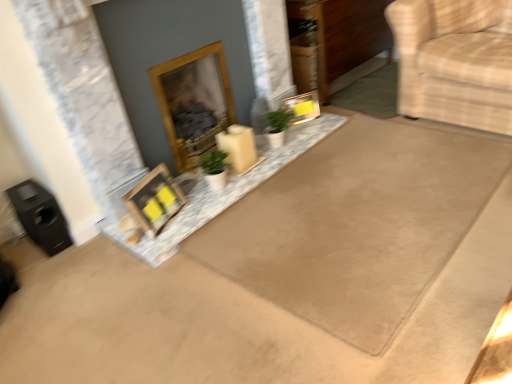
What do you see at coordinates (303, 107) in the screenshot?
I see `matte gold picture frame at center, the 2th picture frame positioned from the front` at bounding box center [303, 107].

Describe the element at coordinates (194, 102) in the screenshot. This screenshot has height=384, width=512. I see `wooden fireplace at center` at that location.

This screenshot has height=384, width=512. What do you see at coordinates (154, 201) in the screenshot?
I see `wooden picture frame at center, acting as the 2th picture frame starting from the right` at bounding box center [154, 201].

Image resolution: width=512 pixels, height=384 pixels. I want to click on beige carpet at upper right, which is the 2th doormat in left-to-right order, so click(x=371, y=93).

In the scene shown: What is the approximate height of beige carpet at center, marked as the first doormat in a left-to-right arrangement?

beige carpet at center, marked as the first doormat in a left-to-right arrangement, is 3.67 centimeters tall.

What are the coordinates of `matte gold picture frame at center, which is the second picture frame from left to right` in the screenshot? It's located at (303, 107).

Which object is thinner, white marble tray at center or matte gold picture frame at center, the 1th picture frame when ordered from right to left?

matte gold picture frame at center, the 1th picture frame when ordered from right to left.

Is the position of white marble tray at center less distant than that of matte gold picture frame at center, which is the second picture frame from left to right?

That is True.

Choose the correct answer: Is white marble tray at center inside matte gold picture frame at center, the 1th picture frame when ordered from right to left, or outside it?

white marble tray at center exists outside the volume of matte gold picture frame at center, the 1th picture frame when ordered from right to left.

From the image's perspective, between white marble tray at center and matte gold picture frame at center, which ranks as the 2th picture frame in bottom-to-top order, who is located below?

white marble tray at center, from the image's perspective.

In the scene shown: Is beige fabric armchair at right shorter than wooden picture frame at center, which appears as the 1th picture frame when viewed from the left?

No, beige fabric armchair at right is not shorter than wooden picture frame at center, which appears as the 1th picture frame when viewed from the left.

From a real-world perspective, is beige fabric armchair at right positioned under wooden picture frame at center, which appears as the second picture frame when viewed from the top, based on gravity?

No, from a real-world perspective, beige fabric armchair at right is not beneath wooden picture frame at center, which appears as the second picture frame when viewed from the top.

Can you tell me how much beige fabric armchair at right and wooden picture frame at center, which appears as the second picture frame when viewed from the top, differ in facing direction?

The facing directions of beige fabric armchair at right and wooden picture frame at center, which appears as the second picture frame when viewed from the top, are 106 degrees apart.

From the image's perspective, which object appears higher, beige fabric armchair at right or wooden picture frame at center, which is the 1th picture frame in bottom-to-top order?

From the image's view, beige fabric armchair at right is above.

Is beige carpet at upper right, positioned as the 1th doormat in right-to-left order, shorter than wooden fireplace at center?

Yes, beige carpet at upper right, positioned as the 1th doormat in right-to-left order, is shorter than wooden fireplace at center.

Is point (388, 94) positioned after point (176, 78)?

Yes.

Which object is positioned more to the right, beige carpet at upper right, which is the 2th doormat in left-to-right order, or wooden fireplace at center?

Positioned to the right is beige carpet at upper right, which is the 2th doormat in left-to-right order.

From a real-world perspective, who is located higher, wooden fireplace at center or matte gold picture frame at center, the 1th picture frame when ordered from back to front?

wooden fireplace at center, from a real-world perspective.

From the image's perspective, which is below, wooden fireplace at center or matte gold picture frame at center, the 1th picture frame when ordered from back to front?

wooden fireplace at center appears lower in the image.

Considering the relative sizes of wooden fireplace at center and matte gold picture frame at center, the 1th picture frame when ordered from right to left, in the image provided, is wooden fireplace at center shorter than matte gold picture frame at center, the 1th picture frame when ordered from right to left,?

Incorrect, the height of wooden fireplace at center does not fall short of that of matte gold picture frame at center, the 1th picture frame when ordered from right to left.

Does point (187, 106) lie in front of point (294, 98)?

Yes, point (187, 106) is in front of point (294, 98).

Can you confirm if wooden picture frame at center, which appears as the 1th picture frame when viewed from the left, is bigger than beige carpet at center, marked as the first doormat in a left-to-right arrangement?

No.

From the image's perspective, relative to beige carpet at center, marked as the first doormat in a left-to-right arrangement, is wooden picture frame at center, which appears as the second picture frame when viewed from the top, above or below?

Based on their image positions, wooden picture frame at center, which appears as the second picture frame when viewed from the top, is located beneath beige carpet at center, marked as the first doormat in a left-to-right arrangement.

Where is `the 2nd picture frame to the left of the beige carpet at center, acting as the second doormat starting from the right, counting from the anchor's position`? This screenshot has height=384, width=512. the 2nd picture frame to the left of the beige carpet at center, acting as the second doormat starting from the right, counting from the anchor's position is located at coordinates (154, 201).

Between wooden picture frame at center, which appears as the 1th picture frame when viewed from the left, and beige carpet at center, marked as the first doormat in a left-to-right arrangement, which one has larger width?

beige carpet at center, marked as the first doormat in a left-to-right arrangement, is wider.

From the image's perspective, which picture frame is the 1st one below the beige carpet at upper right, positioned as the 1th doormat in right-to-left order? Please provide its 2D coordinates.

[(303, 107)]

What's the angular difference between matte gold picture frame at center, which ranks as the 2th picture frame in bottom-to-top order, and beige carpet at upper right, positioned as the 1th doormat in right-to-left order,'s facing directions?

The facing directions of matte gold picture frame at center, which ranks as the 2th picture frame in bottom-to-top order, and beige carpet at upper right, positioned as the 1th doormat in right-to-left order, are 65.4 degrees apart.

Which object is further away from the camera taking this photo, matte gold picture frame at center, the 2th picture frame positioned from the front, or beige carpet at upper right, which is the 2th doormat in left-to-right order?

beige carpet at upper right, which is the 2th doormat in left-to-right order, is behind.

How distant is matte gold picture frame at center, the 2th picture frame positioned from the front, from beige carpet at upper right, which is the 2th doormat in left-to-right order?

matte gold picture frame at center, the 2th picture frame positioned from the front, and beige carpet at upper right, which is the 2th doormat in left-to-right order, are 19.50 inches apart from each other.

Based on the photo, is beige fabric armchair at right shorter than white marble tray at center?

In fact, beige fabric armchair at right may be taller than white marble tray at center.

Which of these two, beige fabric armchair at right or white marble tray at center, is bigger?

Bigger between the two is beige fabric armchair at right.

In the scene shown: How much distance is there between beige fabric armchair at right and white marble tray at center?

They are 33.60 inches apart.

From the image's perspective, is beige fabric armchair at right on white marble tray at center?

Yes, from the image's perspective, beige fabric armchair at right is on top of white marble tray at center.

From a real-world perspective, starting from the white marble tray at center, which picture frame is the 1st one vertically above it? Please provide its 2D coordinates.

[(303, 107)]

The height and width of the screenshot is (384, 512). Identify the location of the 2nd picture frame to the left of the beige fabric armchair at right, starting your count from the anchor. (154, 201).

From the image, which object appears to be nearer to wooden fireplace at center, matte gold picture frame at center, the 1th picture frame when ordered from right to left, or white marble tray at center?

white marble tray at center lies closer to wooden fireplace at center than the other object.

From the image, which object appears to be nearer to beige carpet at center, marked as the first doormat in a left-to-right arrangement, wooden picture frame at center, which appears as the 1th picture frame when viewed from the left, or wooden fireplace at center?

wooden picture frame at center, which appears as the 1th picture frame when viewed from the left, lies closer to beige carpet at center, marked as the first doormat in a left-to-right arrangement, than the other object.

When comparing their distances from wooden fireplace at center, does wooden picture frame at center, acting as the 2th picture frame starting from the right, or white marble tray at center seem closer?

The object closer to wooden fireplace at center is white marble tray at center.

In the scene shown: Based on their spatial positions, is beige carpet at upper right, positioned as the 1th doormat in right-to-left order, or wooden picture frame at center, which is the second picture frame in back-to-front order, closer to wooden fireplace at center?

wooden picture frame at center, which is the second picture frame in back-to-front order, lies closer to wooden fireplace at center than the other object.

When comparing their distances from beige carpet at upper right, positioned as the 1th doormat in right-to-left order, does beige carpet at center, acting as the second doormat starting from the right, or beige fabric armchair at right seem closer?

The object closer to beige carpet at upper right, positioned as the 1th doormat in right-to-left order, is beige fabric armchair at right.

Which object lies nearer to the anchor point beige carpet at upper right, which is the 2th doormat in left-to-right order, beige carpet at center, acting as the second doormat starting from the right, or white marble tray at center?

white marble tray at center is closer to beige carpet at upper right, which is the 2th doormat in left-to-right order.

Looking at the image, which one is located closer to matte gold picture frame at center, which is the second picture frame from left to right, wooden picture frame at center, which is the 1th picture frame in bottom-to-top order, or beige fabric armchair at right?

beige fabric armchair at right is closer to matte gold picture frame at center, which is the second picture frame from left to right.

Estimate the real-world distances between objects in this image. Which object is closer to wooden picture frame at center, which is the second picture frame in back-to-front order, beige fabric armchair at right or wooden fireplace at center?

The object closer to wooden picture frame at center, which is the second picture frame in back-to-front order, is wooden fireplace at center.

The width and height of the screenshot is (512, 384). I want to click on furniture between beige carpet at center, marked as the first doormat in a left-to-right arrangement, and beige carpet at upper right, positioned as the 1th doormat in right-to-left order, from front to back, so click(455, 61).

Identify the location of concrete between wooden picture frame at center, acting as the 2th picture frame starting from the right, and beige carpet at upper right, positioned as the 1th doormat in right-to-left order. (222, 191).

The height and width of the screenshot is (384, 512). In order to click on fireplace between beige carpet at center, acting as the second doormat starting from the right, and matte gold picture frame at center, which is the 1th picture frame in top-to-bottom order, in the front-back direction in this screenshot , I will do `click(194, 102)`.

Locate an element on the screen. picture frame between wooden fireplace at center and beige carpet at upper right, positioned as the 1th doormat in right-to-left order, in the horizontal direction is located at coordinates (303, 107).